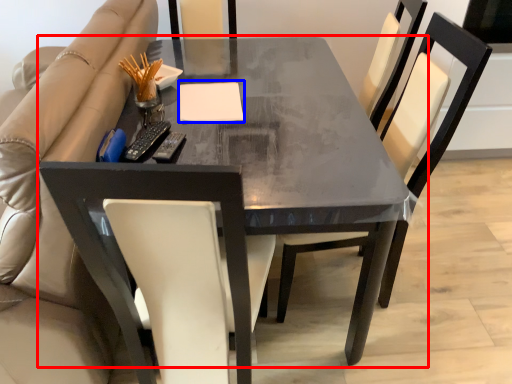
Question: Which point is further to the camera, table (highlighted by a red box) or notepad (highlighted by a blue box)?

Choices:
 (A) table
 (B) notepad

Answer: (B)